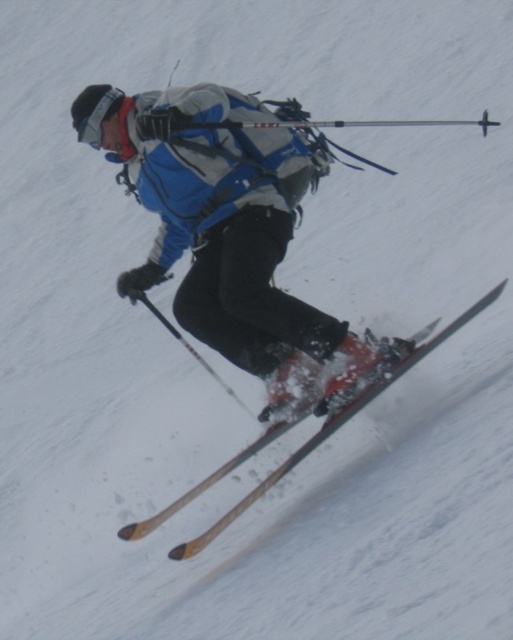
Question: Can you confirm if yellow wood ski at center is positioned above black plastic ski pole at center?

Choices:
 (A) yes
 (B) no

Answer: (B)

Question: Is matte blue jacket at center positioned behind black plastic ski pole at center?

Choices:
 (A) yes
 (B) no

Answer: (B)

Question: Which point is farther from the camera taking this photo?

Choices:
 (A) (134, 298)
 (B) (405, 364)
 (C) (266, 224)

Answer: (A)

Question: Does matte blue jacket at center appear on the left side of yellow wood ski at center?

Choices:
 (A) no
 (B) yes

Answer: (B)

Question: Estimate the real-world distances between objects in this image. Which object is closer to the black plastic ski pole at center?

Choices:
 (A) yellow wood ski at center
 (B) matte blue jacket at center

Answer: (B)

Question: Which of these objects is positioned farthest from the matte blue jacket at center?

Choices:
 (A) black plastic ski pole at center
 (B) yellow wood ski at center

Answer: (B)